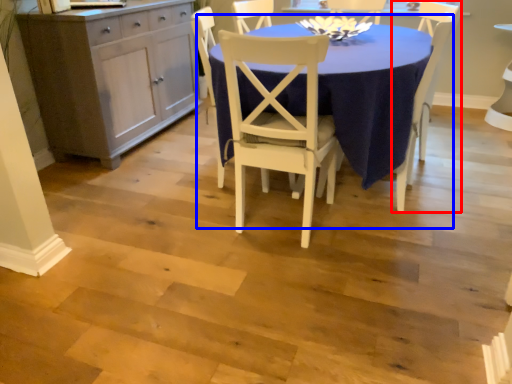
Question: Which point is closer to the camera, chair (highlighted by a red box) or kitchen & dining room table (highlighted by a blue box)?

Choices:
 (A) chair
 (B) kitchen & dining room table

Answer: (B)